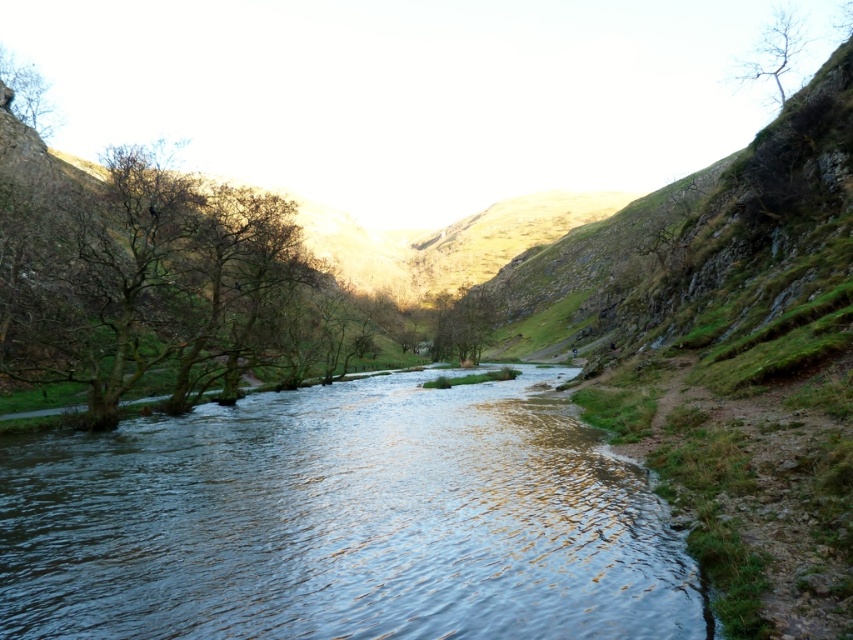
You are standing at the edge of the river and want to walk to the green matte tree at center. Which direction should you turn to avoid the brown leafless tree at upper left?

To reach the green matte tree at center while avoiding the brown leafless tree at upper left, you should turn to your right since the green matte tree at center is located to the right of the brown leafless tree at upper left.

You are an environmental scientist assessing the health of the valley. You observe the green matte tree at center and the brown leafless tree at upper left. Which tree would you prioritize for further study based on their height?

The green matte tree at center has a greater height compared to the brown leafless tree at upper left, so it should be prioritized for study as its height may indicate better health or environmental adaptation.

You are standing at the edge of the river and want to reach the bare branches at left. Which direction should you move to get closer to them without crossing the clear water at center?

You should move to the left bank because the clear water at center is closer to you than the bare branches at left, so moving left would bring you closer to the branches without crossing the water.